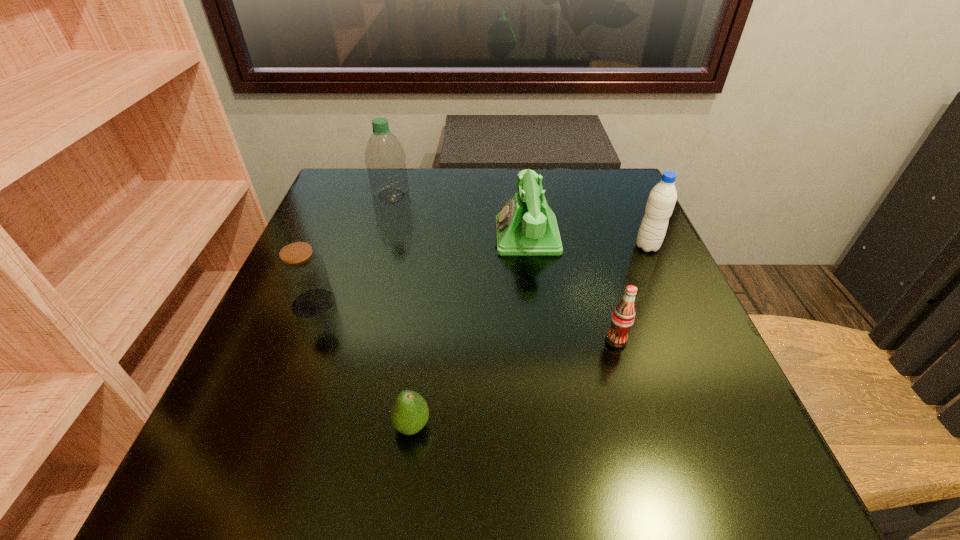
This screenshot has width=960, height=540. In order to click on the left water bottle in this screenshot , I will do `click(385, 159)`.

Where is `the second object from left to right`? Image resolution: width=960 pixels, height=540 pixels. the second object from left to right is located at coordinates (385, 159).

Find the location of a particular element. The image size is (960, 540). the right water bottle is located at coordinates (662, 198).

Locate an element on the screen. This screenshot has height=540, width=960. the rightmost object is located at coordinates point(662,198).

Image resolution: width=960 pixels, height=540 pixels. I want to click on the fourth object from left to right, so pos(526,225).

Find the location of a particular element. The image size is (960, 540). the fourth farthest object is located at coordinates (303, 274).

This screenshot has width=960, height=540. In order to click on the leftmost object in this screenshot , I will do `click(303, 274)`.

The image size is (960, 540). I want to click on the second object from right to left, so click(x=622, y=319).

Where is `the second nearest object`? the second nearest object is located at coordinates (622, 319).

I want to click on the shortest object, so click(x=409, y=413).